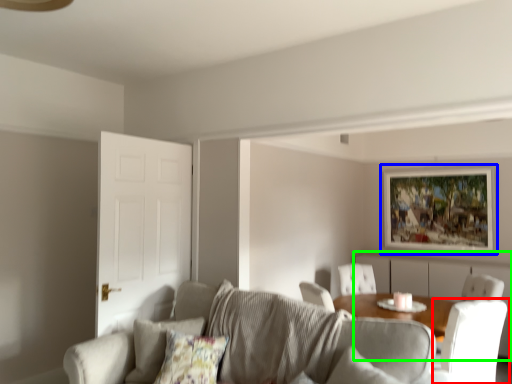
Question: Considering the real-world distances, which object is closest to chair (highlighted by a red box)? picture frame (highlighted by a blue box) or dresser (highlighted by a green box).

Choices:
 (A) picture frame
 (B) dresser

Answer: (B)